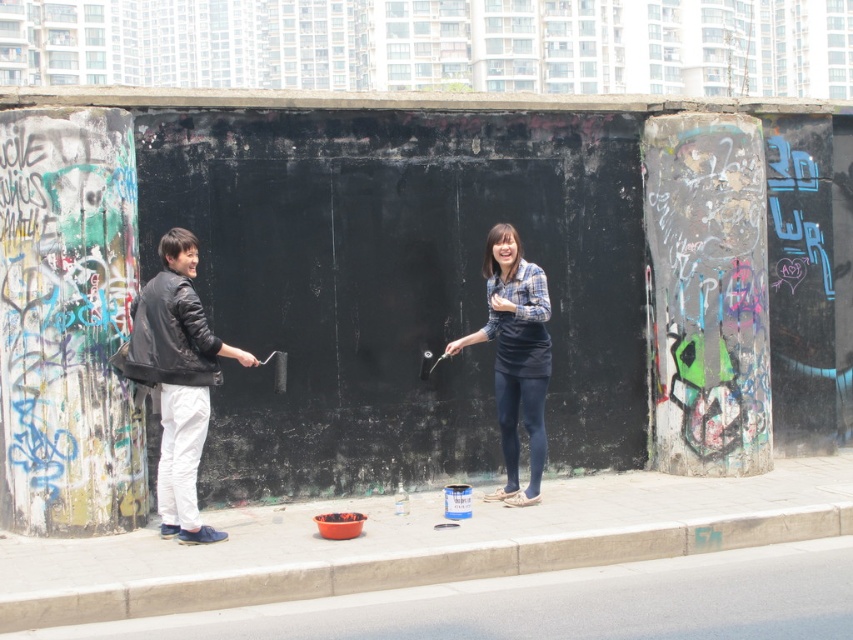
You are standing in front of the black wall between the two concrete pillars. There is a point marked at coordinates (x=177, y=380). Which object is located at that point?

The point at coordinates (x=177, y=380) marks the black leather jacket at left.

Where is the black leather jacket at left located in the image?

The black leather jacket at left is located at point 0.594 on the x axis and 0.209 on the y axis.